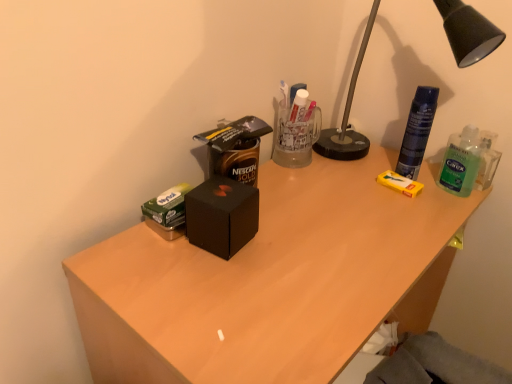
Identify the location of free spot to the right of black matte box at center. (317, 243).